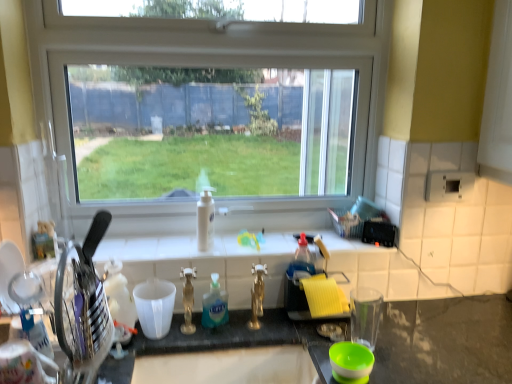
Question: Considering the relative sizes of white glossy bottle at center, which ranks as the second bottle in bottom-to-top order, and translucent plastic bottle at center, the 2th bottle positioned from the top, in the image provided, is white glossy bottle at center, which ranks as the second bottle in bottom-to-top order, smaller than translucent plastic bottle at center, the 2th bottle positioned from the top,?

Choices:
 (A) no
 (B) yes

Answer: (B)

Question: Does white glossy bottle at center, which appears as the first bottle when viewed from the top, lie behind translucent plastic bottle at center, which is the 2th bottle from back to front?

Choices:
 (A) yes
 (B) no

Answer: (A)

Question: From the image's perspective, is white glossy bottle at center, which appears as the first bottle when viewed from the top, located above translucent plastic bottle at center, which is the 2th bottle from back to front?

Choices:
 (A) no
 (B) yes

Answer: (B)

Question: Is white glossy bottle at center, which appears as the first bottle when viewed from the top, surrounding translucent plastic bottle at center, which is the 1th bottle in bottom-to-top order?

Choices:
 (A) yes
 (B) no

Answer: (B)

Question: Is white glossy bottle at center, which appears as the first bottle when viewed from the top, outside of translucent plastic bottle at center, which is the 2th bottle from back to front?

Choices:
 (A) no
 (B) yes

Answer: (B)

Question: Considering the relative sizes of white glossy bottle at center, which is counted as the first bottle, starting from the back, and translucent plastic bottle at center, which is the 1th bottle in bottom-to-top order, in the image provided, is white glossy bottle at center, which is counted as the first bottle, starting from the back, shorter than translucent plastic bottle at center, which is the 1th bottle in bottom-to-top order,?

Choices:
 (A) yes
 (B) no

Answer: (B)

Question: Considering the relative positions of yellow sponge at right, which ranks as the 1th appliance in right-to-left order, and translucent plastic bottle at center, the 2th bottle positioned from the top, in the image provided, is yellow sponge at right, which ranks as the 1th appliance in right-to-left order, to the right of translucent plastic bottle at center, the 2th bottle positioned from the top, from the viewer's perspective?

Choices:
 (A) no
 (B) yes

Answer: (B)

Question: Is yellow sponge at right, which ranks as the 1th appliance in right-to-left order, positioned far away from translucent plastic bottle at center, which is the 1th bottle in bottom-to-top order?

Choices:
 (A) yes
 (B) no

Answer: (B)

Question: Does yellow sponge at right, positioned as the 1th appliance in back-to-front order, come in front of translucent plastic bottle at center, which is the 1th bottle in bottom-to-top order?

Choices:
 (A) yes
 (B) no

Answer: (A)

Question: From the image's perspective, is yellow sponge at right, the 2th appliance positioned from the front, below translucent plastic bottle at center, which is the 1th bottle in bottom-to-top order?

Choices:
 (A) yes
 (B) no

Answer: (B)

Question: Considering the relative sizes of yellow sponge at right, positioned as the 1th appliance in back-to-front order, and translucent plastic bottle at center, the 2th bottle positioned from the top, in the image provided, is yellow sponge at right, positioned as the 1th appliance in back-to-front order, taller than translucent plastic bottle at center, the 2th bottle positioned from the top,?

Choices:
 (A) no
 (B) yes

Answer: (B)

Question: Is yellow sponge at right, marked as the 2th appliance in a left-to-right arrangement, directly adjacent to translucent plastic bottle at center, the first bottle in the front-to-back sequence?

Choices:
 (A) no
 (B) yes

Answer: (A)

Question: Can you confirm if metallic knife block at left, which is the 1th appliance from front to back, is shorter than transparent glass window at center?

Choices:
 (A) yes
 (B) no

Answer: (A)